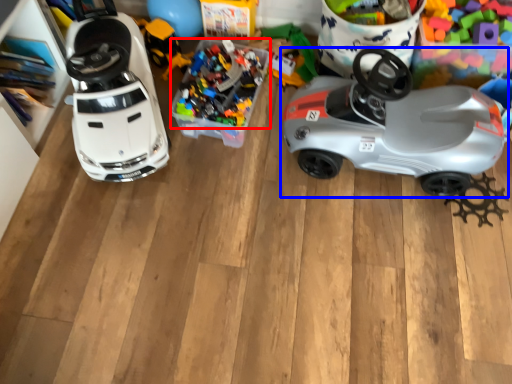
Question: Which object appears farthest to the camera in this image, toy (highlighted by a red box) or car (highlighted by a blue box)?

Choices:
 (A) toy
 (B) car

Answer: (A)